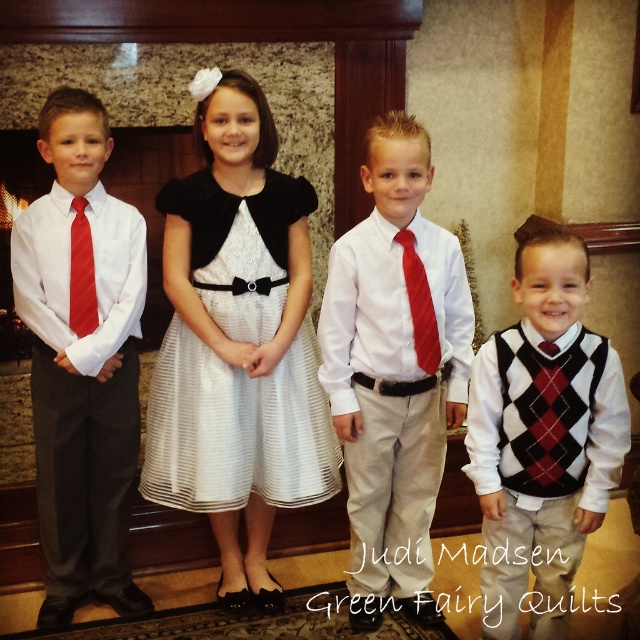
Based on the scene description, which object is taller between the white satin dress at center and the red satin tie at left?

The white satin dress at center is taller than the red satin tie at left according to the description.

Based on the scene description, which object is taller between the matte white shirt at left and the argyle sweater vest at center?

The matte white shirt at left is much taller than the argyle sweater vest at center according to the description.